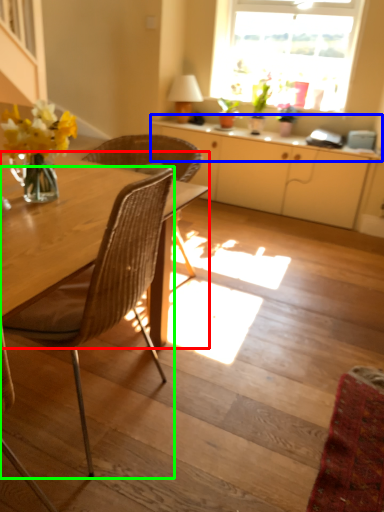
Question: Based on their relative distances, which object is farther from round table (highlighted by a red box)? Choose from counter top (highlighted by a blue box) and chair (highlighted by a green box).

Choices:
 (A) counter top
 (B) chair

Answer: (A)